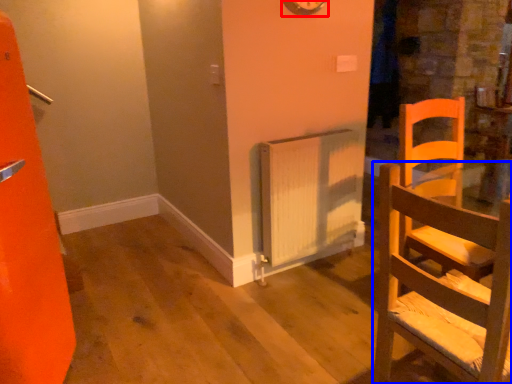
Question: Which of the following is the closest to the observer, clock (highlighted by a red box) or chair (highlighted by a blue box)?

Choices:
 (A) clock
 (B) chair

Answer: (B)